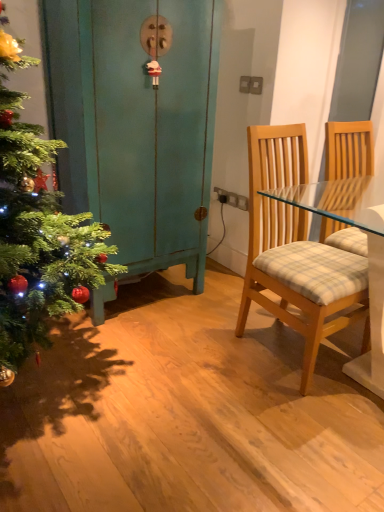
At what (x,y) coordinates should I click in order to perform the action: click on free space in front of teal painted wood dresser at left. Please return your answer as a coordinate pair (x, y). Looking at the image, I should click on (135, 350).